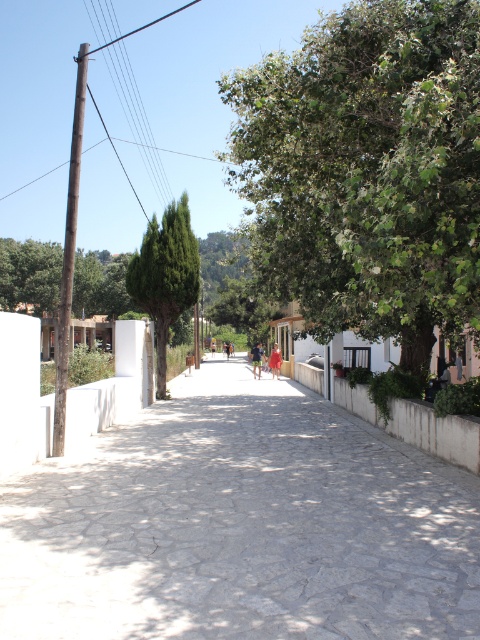
You are a tourist standing at the entrance of the street. You want to take a photo of the green leafy tree at center without the gray stone path at center appearing in the frame. Is it possible to do so by moving closer to the tree?

The gray stone path at center is in front of the green leafy tree at center, so moving closer to the tree would still keep the path between you and the tree. Therefore, it might not be possible to exclude the path from the photo without moving to a different angle or position.

You are a bird looking for a place to perch. You see two trees at the center of the image, a green leafy tree at center and a green matte tree at center. Which tree is positioned higher in the scene?

The green leafy tree at center is located above the green matte tree at center, so it is positioned higher in the scene.

You are standing at the point with coordinates point (147, 225) and want to walk towards the point with coordinates point (249, 380). Given the street layout described in the scene, will you have a clear path without obstacles between these two points?

Yes, you will have a clear path between point (147, 225) and point (249, 380) because the street is paved and flanked by walls on both sides, and there are no mentioned obstacles blocking the path between them.